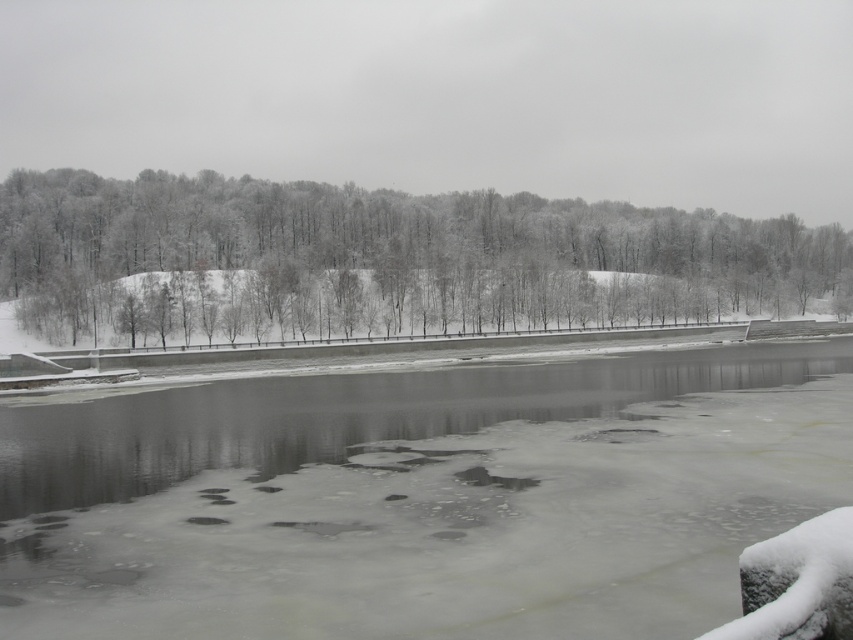
Between frozen ice at center and white frosty trees at upper left, which one is positioned higher?

white frosty trees at upper left is above.

Who is more forward, (524, 412) or (138, 241)?

Point (524, 412) is more forward.

Find the location of a particular element. The image size is (853, 640). frozen ice at center is located at coordinates (421, 499).